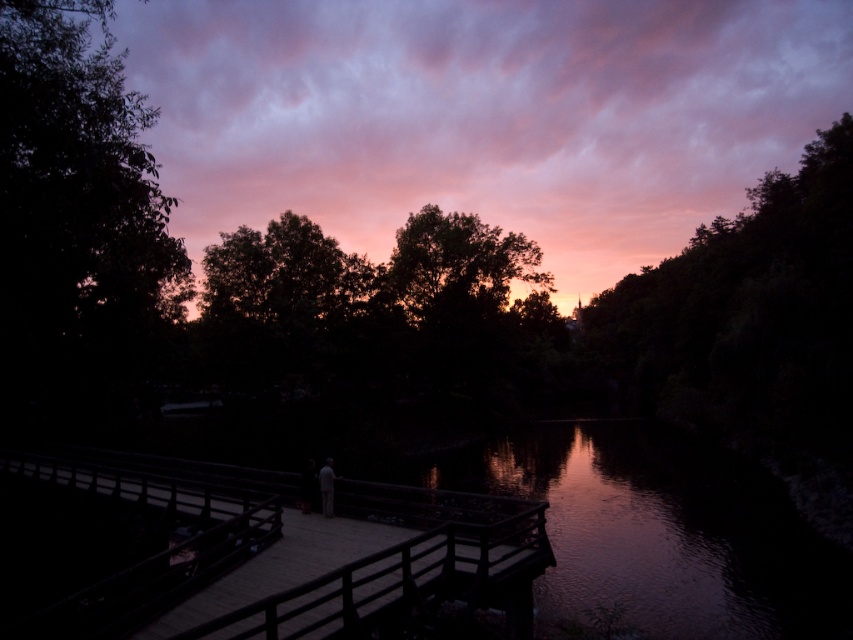
Is dark green leafy tree at left to the right of glossy water at center from the viewer's perspective?

No, dark green leafy tree at left is not to the right of glossy water at center.

Is dark green leafy tree at left smaller than glossy water at center?

Actually, dark green leafy tree at left might be larger than glossy water at center.

Is point (109, 68) in front of point (625, 516)?

Yes, it is in front of point (625, 516).

At what (x,y) coordinates should I click in order to perform the action: click on dark green leafy tree at left. Please return your answer as a coordinate pair (x, y). This screenshot has height=640, width=853. Looking at the image, I should click on (77, 221).

Is glossy water at center smaller than light gray fabric person at center?

No, glossy water at center is not smaller than light gray fabric person at center.

How distant is glossy water at center from light gray fabric person at center?

glossy water at center and light gray fabric person at center are 13.06 meters apart from each other.

Image resolution: width=853 pixels, height=640 pixels. Describe the element at coordinates (660, 532) in the screenshot. I see `glossy water at center` at that location.

Image resolution: width=853 pixels, height=640 pixels. Identify the location of glossy water at center. (660, 532).

Does wooden dock at center lie behind dark green leafy tree at left?

No, wooden dock at center is in front of dark green leafy tree at left.

Is wooden dock at center closer to the viewer compared to dark green leafy tree at left?

Yes, it is in front of dark green leafy tree at left.

Is point (415, 544) in front of point (42, 106)?

Yes, it is.

Where is `wooden dock at center`? This screenshot has height=640, width=853. wooden dock at center is located at coordinates click(286, 554).